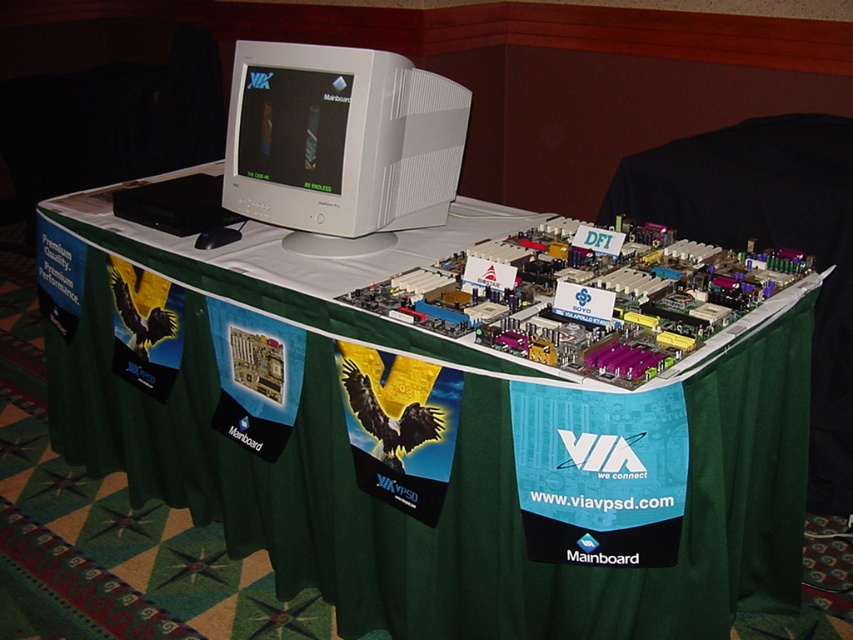
Question: Can you confirm if green fabric table at center is wider than white plastic monitor at upper center?

Choices:
 (A) no
 (B) yes

Answer: (B)

Question: Among these objects, which one is nearest to the camera?

Choices:
 (A) green fabric table at center
 (B) white plastic monitor at upper center

Answer: (A)

Question: Is green fabric table at center bigger than white plastic monitor at upper center?

Choices:
 (A) no
 (B) yes

Answer: (B)

Question: Is green fabric table at center smaller than white plastic monitor at upper center?

Choices:
 (A) no
 (B) yes

Answer: (A)